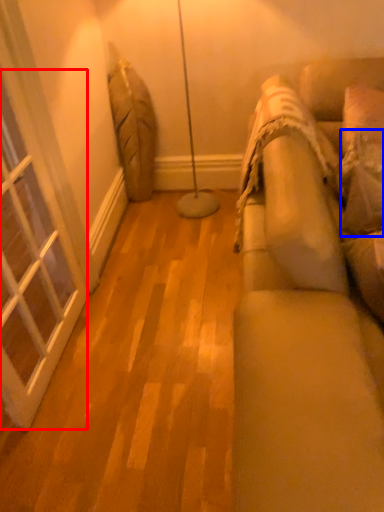
Question: Which point is closer to the camera, window (highlighted by a red box) or pillow (highlighted by a blue box)?

Choices:
 (A) window
 (B) pillow

Answer: (A)